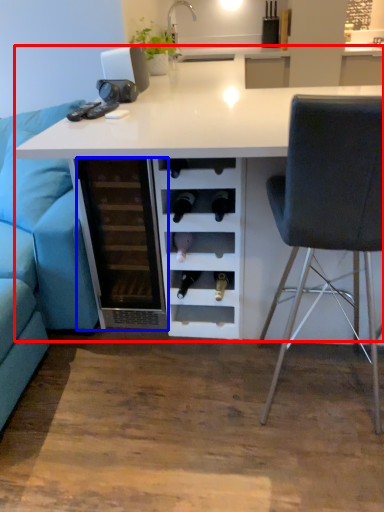
Question: Which of the following is the farthest to the observer, table (highlighted by a red box) or file cabinet (highlighted by a blue box)?

Choices:
 (A) table
 (B) file cabinet

Answer: (B)